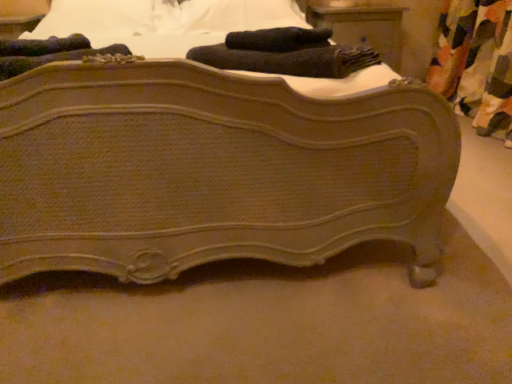
Question: Is matte brown wooden bed at center to the right of multicolored fabric curtain at right from the viewer's perspective?

Choices:
 (A) yes
 (B) no

Answer: (B)

Question: Considering the relative sizes of matte brown wooden bed at center and multicolored fabric curtain at right in the image provided, is matte brown wooden bed at center shorter than multicolored fabric curtain at right?

Choices:
 (A) yes
 (B) no

Answer: (B)

Question: Is matte brown wooden bed at center positioned behind multicolored fabric curtain at right?

Choices:
 (A) yes
 (B) no

Answer: (B)

Question: From the image's perspective, is matte brown wooden bed at center over multicolored fabric curtain at right?

Choices:
 (A) no
 (B) yes

Answer: (A)

Question: Is matte brown wooden bed at center positioned before multicolored fabric curtain at right?

Choices:
 (A) no
 (B) yes

Answer: (B)

Question: From the image's perspective, is matte brown wooden bed at center located beneath multicolored fabric curtain at right?

Choices:
 (A) yes
 (B) no

Answer: (A)

Question: Is matte brown wood nightstand at upper center next to multicolored fabric curtain at right and touching it?

Choices:
 (A) no
 (B) yes

Answer: (A)

Question: From the image's perspective, does matte brown wood nightstand at upper center appear lower than multicolored fabric curtain at right?

Choices:
 (A) no
 (B) yes

Answer: (A)

Question: Would you say matte brown wood nightstand at upper center is a long distance from multicolored fabric curtain at right?

Choices:
 (A) no
 (B) yes

Answer: (A)

Question: Is matte brown wood nightstand at upper center turned away from multicolored fabric curtain at right?

Choices:
 (A) no
 (B) yes

Answer: (A)

Question: From a real-world perspective, is matte brown wood nightstand at upper center under multicolored fabric curtain at right?

Choices:
 (A) no
 (B) yes

Answer: (A)

Question: Considering the relative sizes of matte brown wood nightstand at upper center and multicolored fabric curtain at right in the image provided, is matte brown wood nightstand at upper center smaller than multicolored fabric curtain at right?

Choices:
 (A) yes
 (B) no

Answer: (A)

Question: Can you confirm if matte brown wood nightstand at upper center is positioned to the right of black soft towel at upper center?

Choices:
 (A) yes
 (B) no

Answer: (A)